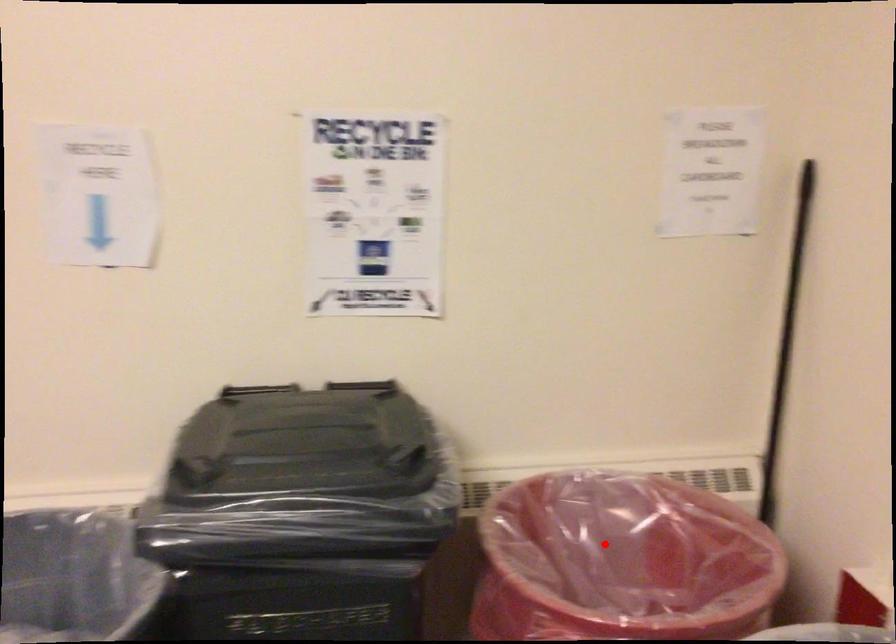
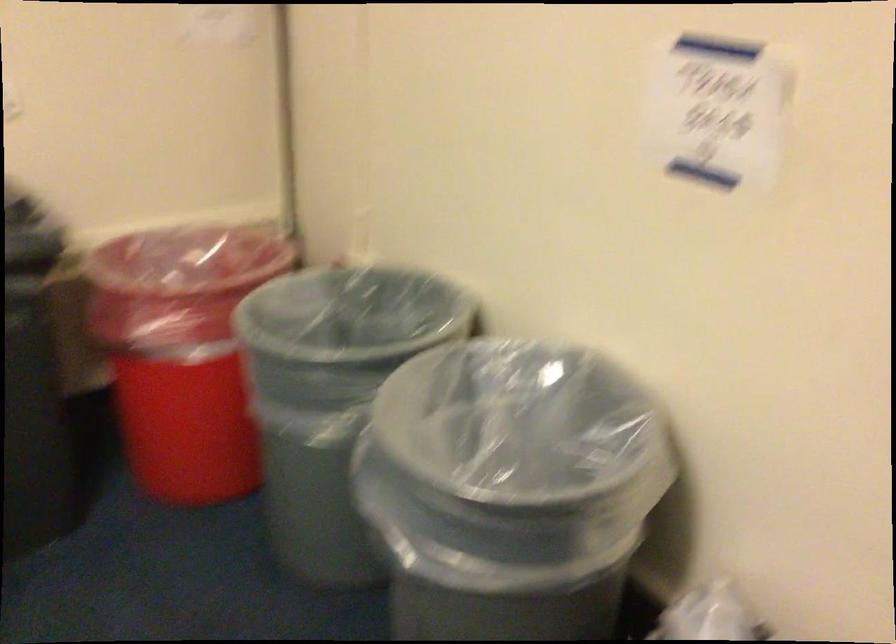
Question: I am providing you with two images of the same scene from different viewpoints. Given a red point in image1, look at the same physical point in image2. Is it:

Choices:
 (A) Closer to the viewpoint
 (B) Farther from the viewpoint

Answer: (B)